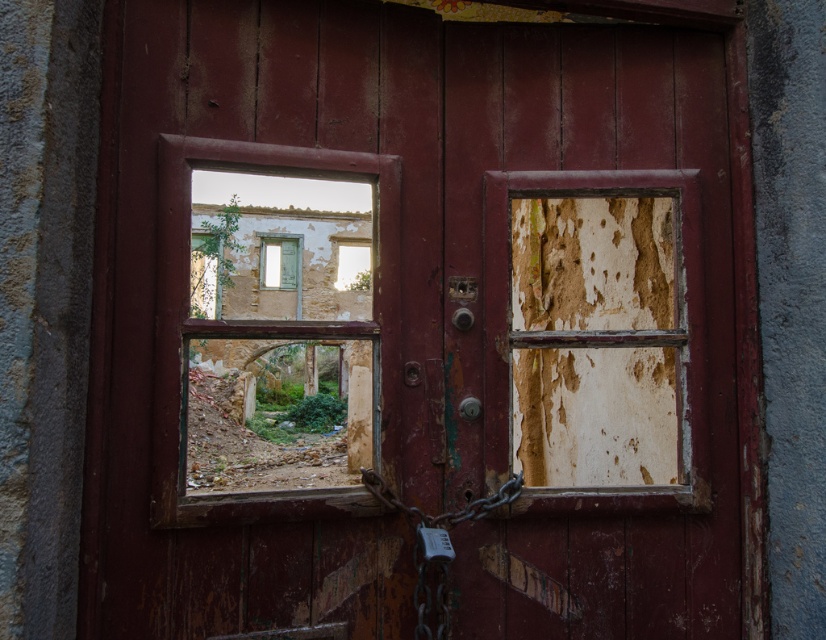
In the scene shown: You are an architect inspecting the building. You notice the matte white frame at center and the cracked glass window at upper center. Which object is taller?

The matte white frame at center is much taller than the cracked glass window at upper center.

You are a painter assessing the door for restoration. You notice the matte white frame at center and the metallic silver lock at lower center. Which object would require more material to cover its surface area?

The matte white frame at center is bigger than the metallic silver lock at lower center, so it would require more material to cover its surface area.

You are an architect analyzing the structure of the weathered red wooden door with two rectangular windows. You need to locate the matte white frame at center. What are its coordinates?

The coordinates of the matte white frame at center are at point (279, 262).